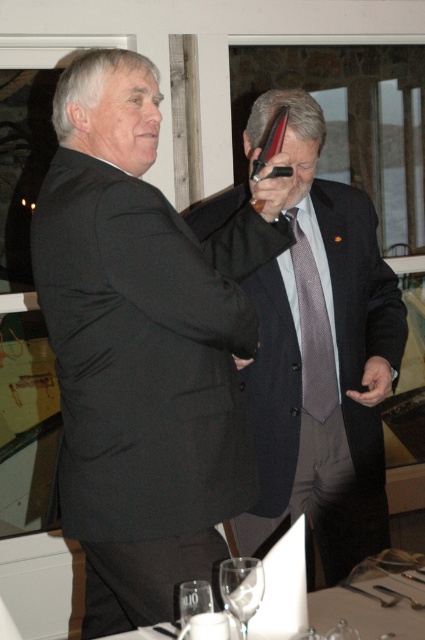
Please provide the 2D coordinates of the matte black suit at center as per the image coordinate system where the origin is at the bottom left corner.

The 2D coordinates of the matte black suit at center are at point (320, 356).